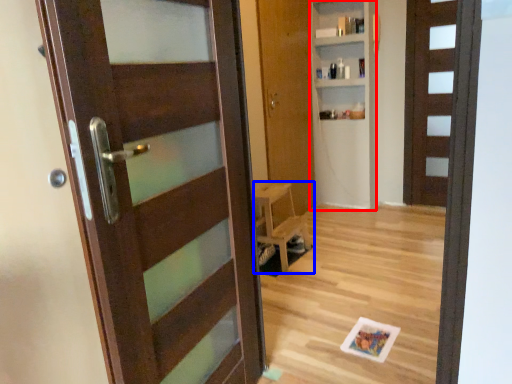
Question: Among these objects, which one is farthest to the camera, bookshelf (highlighted by a red box) or furniture (highlighted by a blue box)?

Choices:
 (A) bookshelf
 (B) furniture

Answer: (A)